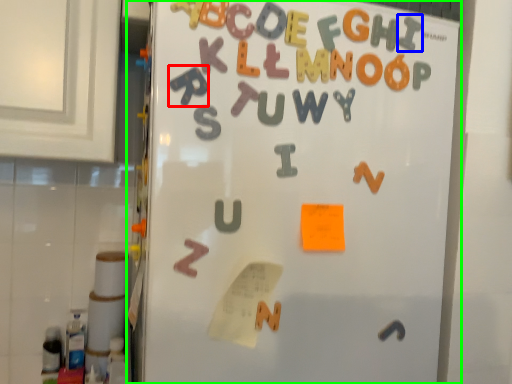
Question: Which object is the farthest from alphabet (highlighted by a red box)? Choose among these: letter (highlighted by a blue box) or refrigerator (highlighted by a green box).

Choices:
 (A) letter
 (B) refrigerator

Answer: (A)